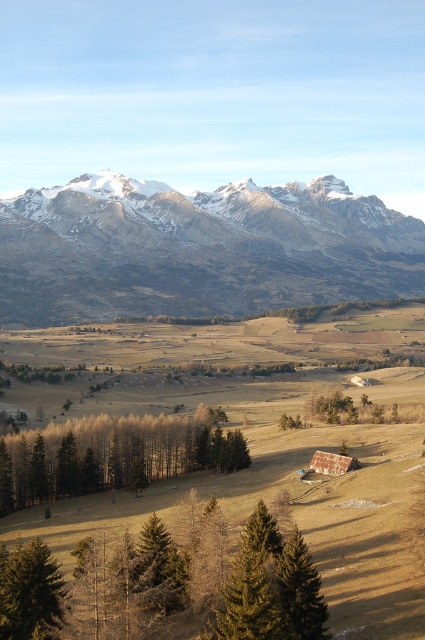
Question: Among these points, which one is farthest from the camera?

Choices:
 (A) (119, 548)
 (B) (34, 602)

Answer: (A)

Question: Does green matte tree at lower center appear under green matte tree at lower left?

Choices:
 (A) yes
 (B) no

Answer: (A)

Question: Based on their relative distances, which object is nearer to the snowy granite mountain range at upper center?

Choices:
 (A) green matte tree at lower center
 (B) green matte tree at lower left

Answer: (A)

Question: Can you confirm if snowy granite mountain range at upper center is thinner than brown matte trees at center?

Choices:
 (A) no
 (B) yes

Answer: (A)

Question: Which point appears closest to the camera in this image?

Choices:
 (A) (167, 637)
 (B) (22, 445)
 (C) (70, 273)

Answer: (A)

Question: Is snowy granite mountain range at upper center thinner than brown matte trees at center?

Choices:
 (A) yes
 (B) no

Answer: (B)